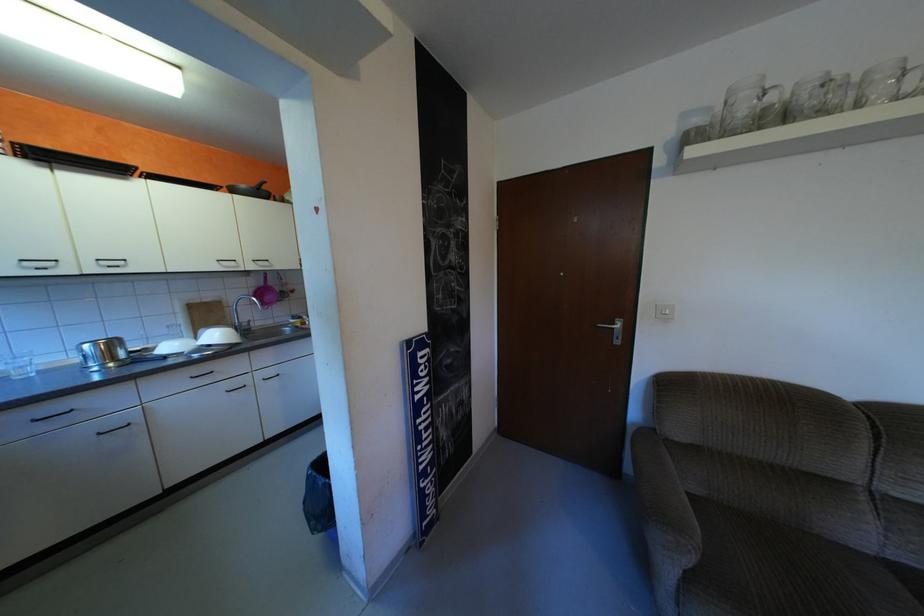
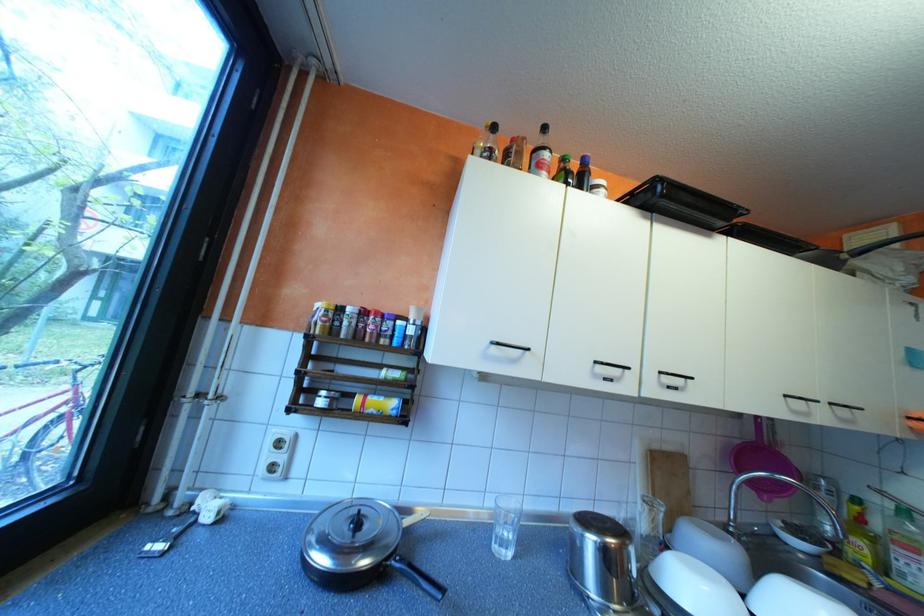
Where in the second image is the point corresponding to pixel 179 346 from the first image?

(709, 592)